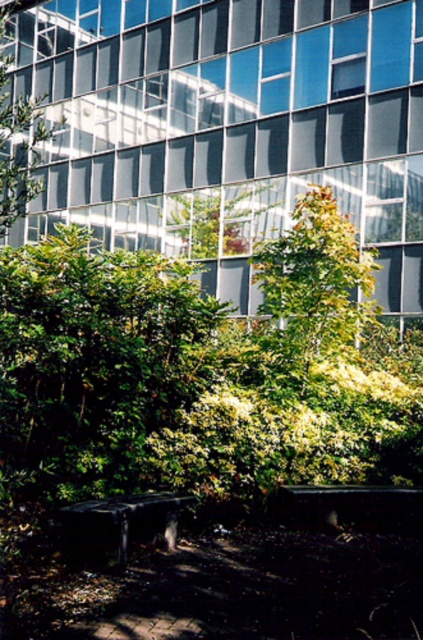
Is point (370, 276) closer to viewer compared to point (158, 529)?

No, it is not.

Locate an element on the screen. green leafy tree at center is located at coordinates (312, 289).

The height and width of the screenshot is (640, 423). Find the location of `green leafy tree at center`. green leafy tree at center is located at coordinates (312, 289).

Does point (324, 214) come closer to viewer compared to point (310, 506)?

No, it is not.

Does green leafy tree at center appear over dark gray concrete bench at lower center?

Yes.

Does point (288, 259) come behind point (327, 508)?

Yes, it is.

The width and height of the screenshot is (423, 640). What are the coordinates of `green leafy tree at center` in the screenshot? It's located at (312, 289).

Does dark brown wooden bench at lower center appear on the right side of dark gray concrete bench at lower center?

No, dark brown wooden bench at lower center is not to the right of dark gray concrete bench at lower center.

Looking at this image, does dark brown wooden bench at lower center have a lesser width compared to dark gray concrete bench at lower center?

Indeed, dark brown wooden bench at lower center has a lesser width compared to dark gray concrete bench at lower center.

Image resolution: width=423 pixels, height=640 pixels. Find the location of `dark brown wooden bench at lower center`. dark brown wooden bench at lower center is located at coordinates (120, 524).